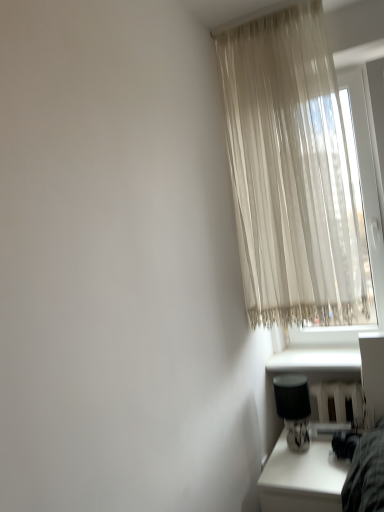
I want to click on vacant space underneath black fabric table lamp at lower right (from a real-world perspective), so click(309, 446).